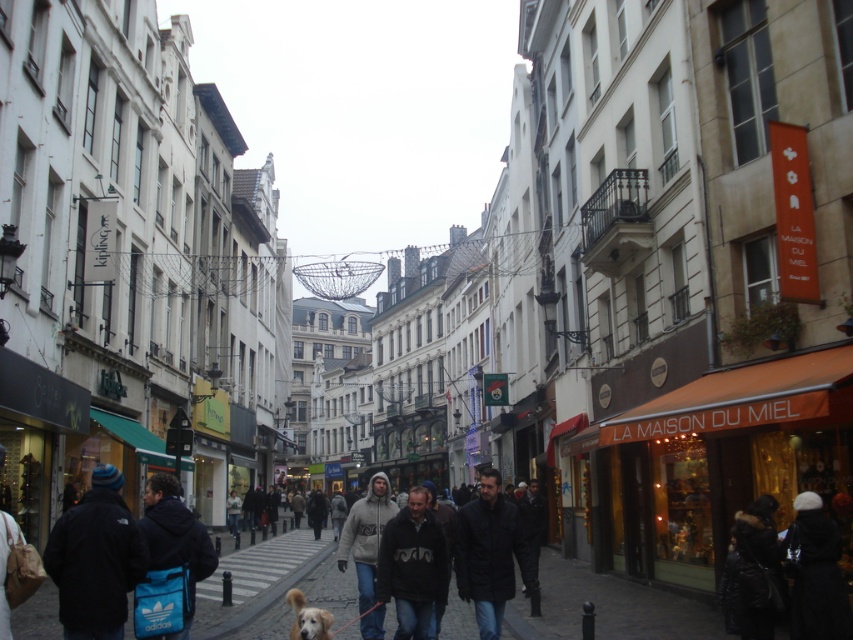
Question: Considering the relative positions of black leather jacket at center and golden fur dog at center in the image provided, where is black leather jacket at center located with respect to golden fur dog at center?

Choices:
 (A) below
 (B) above

Answer: (B)

Question: Which point is farther to the camera?

Choices:
 (A) (300, 592)
 (B) (91, 584)
 (C) (416, 548)

Answer: (A)

Question: Based on their relative distances, which object is farther from the white fleece jacket at center?

Choices:
 (A) dark blue fleece jacket at lower left
 (B) golden fur dog at center
 (C) blue fabric bag at lower left

Answer: (A)

Question: Can you confirm if black matte jacket at center is wider than golden fur dog at center?

Choices:
 (A) yes
 (B) no

Answer: (B)

Question: Which point is farther to the camera?

Choices:
 (A) (346, 525)
 (B) (492, 600)
 (C) (427, 604)

Answer: (A)

Question: Where is black leather jacket at center located in relation to black matte jacket at center in the image?

Choices:
 (A) left
 (B) right

Answer: (B)